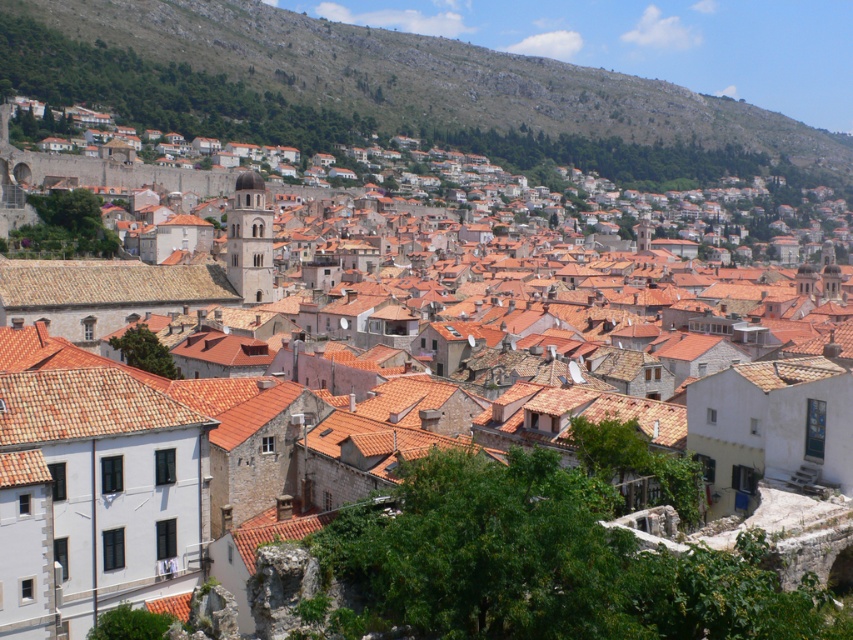
Does green grassy hillside at upper left have a smaller size compared to brown tile roof at center?

Actually, green grassy hillside at upper left might be larger than brown tile roof at center.

Is the position of green grassy hillside at upper left more distant than that of brown tile roof at center?

Yes, it is behind brown tile roof at center.

Is point (540, 90) closer to viewer compared to point (0, 273)?

No, (540, 90) is behind (0, 273).

Find the location of a particular element. The height and width of the screenshot is (640, 853). green grassy hillside at upper left is located at coordinates (430, 76).

Describe the element at coordinates (82, 404) in the screenshot. I see `terracotta tiled roof at lower left` at that location.

Does terracotta tiled roof at lower left have a smaller size compared to brown tile roof at center?

Correct, terracotta tiled roof at lower left occupies less space than brown tile roof at center.

Is point (86, 392) less distant than point (225, 304)?

Yes, point (86, 392) is in front of point (225, 304).

Identify the location of terracotta tiled roof at lower left. (82, 404).

Can you confirm if green grassy hillside at upper left is smaller than terracotta tiled roof at lower left?

No.

Is point (309, 44) positioned before point (82, 385)?

No, (309, 44) is further to viewer.

The image size is (853, 640). Identify the location of green grassy hillside at upper left. (430, 76).